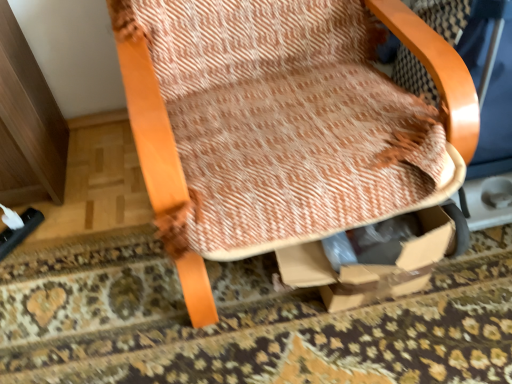
Question: Visually, is wooden textured chair at center positioned to the left or to the right of textured beige rug at center?

Choices:
 (A) left
 (B) right

Answer: (B)

Question: From their relative heights in the image, would you say wooden textured chair at center is taller or shorter than textured beige rug at center?

Choices:
 (A) short
 (B) tall

Answer: (B)

Question: In terms of width, does wooden textured chair at center look wider or thinner when compared to textured beige rug at center?

Choices:
 (A) wide
 (B) thin

Answer: (B)

Question: From a real-world perspective, is textured beige rug at center above or below wooden textured chair at center?

Choices:
 (A) below
 (B) above

Answer: (A)

Question: Which is correct: textured beige rug at center is inside wooden textured chair at center, or outside of it?

Choices:
 (A) inside
 (B) outside

Answer: (B)

Question: Is textured beige rug at center in front of or behind wooden textured chair at center in the image?

Choices:
 (A) front
 (B) behind

Answer: (B)

Question: Considering the positions of textured beige rug at center and wooden textured chair at center in the image, is textured beige rug at center wider or thinner than wooden textured chair at center?

Choices:
 (A) wide
 (B) thin

Answer: (A)